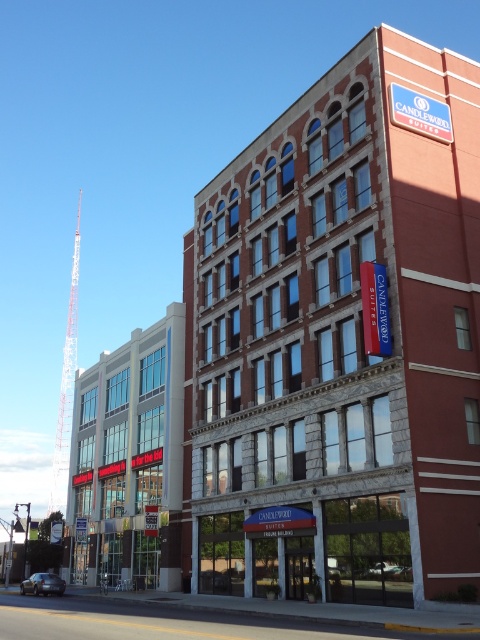
Is red brick building at center shorter than glass storefront at left?

No.

Between red brick building at center and glass storefront at left, which one is positioned lower?

Positioned lower is glass storefront at left.

Is point (292, 454) positioned behind point (127, 548)?

No, (292, 454) is in front of (127, 548).

Locate an element on the screen. Image resolution: width=480 pixels, height=640 pixels. red brick building at center is located at coordinates (344, 339).